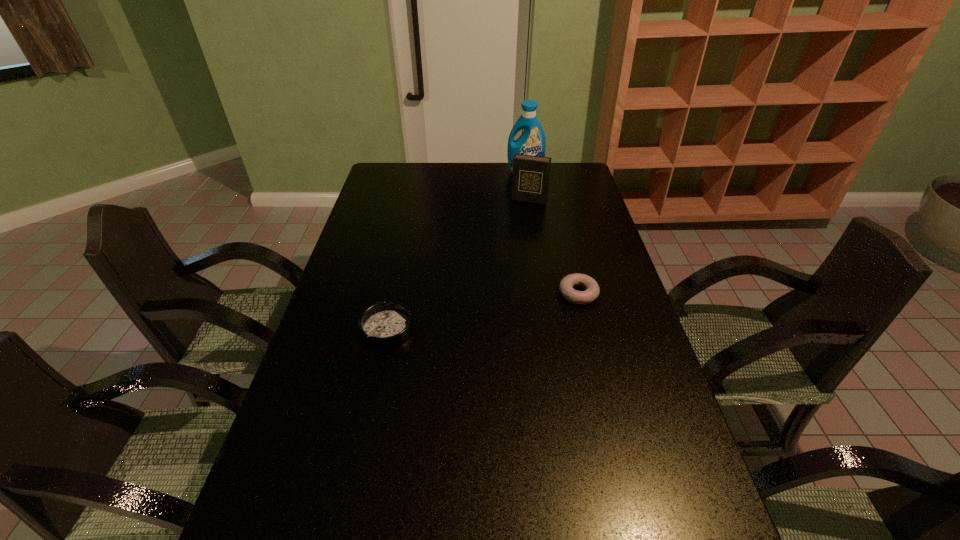
Identify the location of free space at the left edge. (347, 448).

Identify the location of free space at the right edge. The image size is (960, 540). (600, 234).

Identify the location of vacant area at the near left corner. The image size is (960, 540). (264, 514).

Where is `free space at the far right corner of the desktop`? The height and width of the screenshot is (540, 960). free space at the far right corner of the desktop is located at coordinates (583, 186).

In the image, there is a desktop. Find the location of `free space at the near right corner`. free space at the near right corner is located at coordinates (654, 493).

Identify the location of free space between the second nearest object and the third nearest object. The image size is (960, 540). 554,247.

Where is `free spot between the tallest object and the doughnut`? free spot between the tallest object and the doughnut is located at coordinates (551, 233).

At what (x,y) coordinates should I click in order to perform the action: click on free space between the second nearest object and the second farthest object. Please return your answer as a coordinate pair (x, y). This screenshot has width=960, height=540. Looking at the image, I should click on (554, 247).

Identify the location of vacant region between the leftmost object and the detergent. The height and width of the screenshot is (540, 960). (456, 251).

Locate an element on the screen. vacant space in between the leftmost object and the farthest object is located at coordinates 456,251.